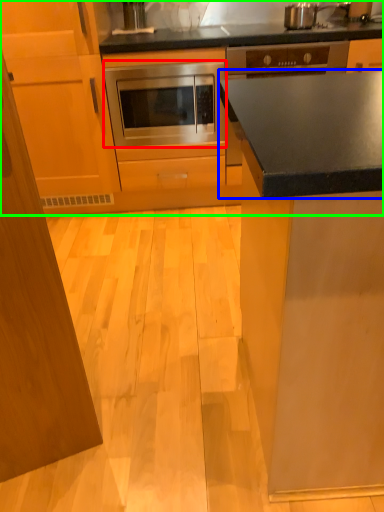
Question: Estimate the real-world distances between objects in this image. Which object is farther from oven (highlighted by a red box), countertop (highlighted by a blue box) or cabinetry (highlighted by a green box)?

Choices:
 (A) countertop
 (B) cabinetry

Answer: (A)